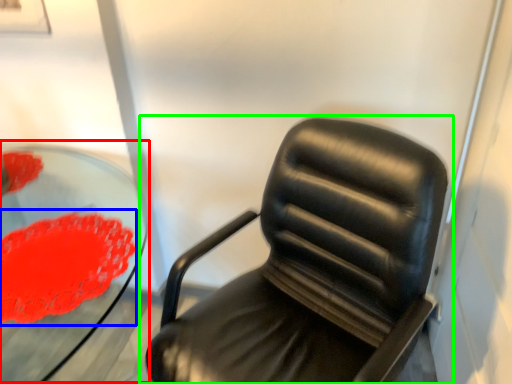
Question: Which object is the farthest from round table (highlighted by a red box)? Choose among these: flower (highlighted by a blue box) or chair (highlighted by a green box).

Choices:
 (A) flower
 (B) chair

Answer: (B)